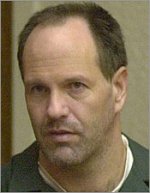
Find the location of `wall`. wall is located at coordinates (134, 28).